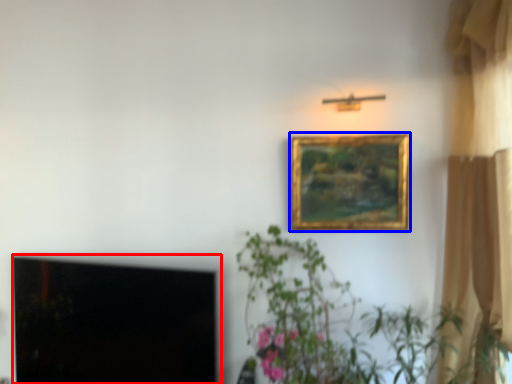
Question: Which of the following is the closest to the observer, window screen (highlighted by a red box) or picture frame (highlighted by a blue box)?

Choices:
 (A) window screen
 (B) picture frame

Answer: (A)